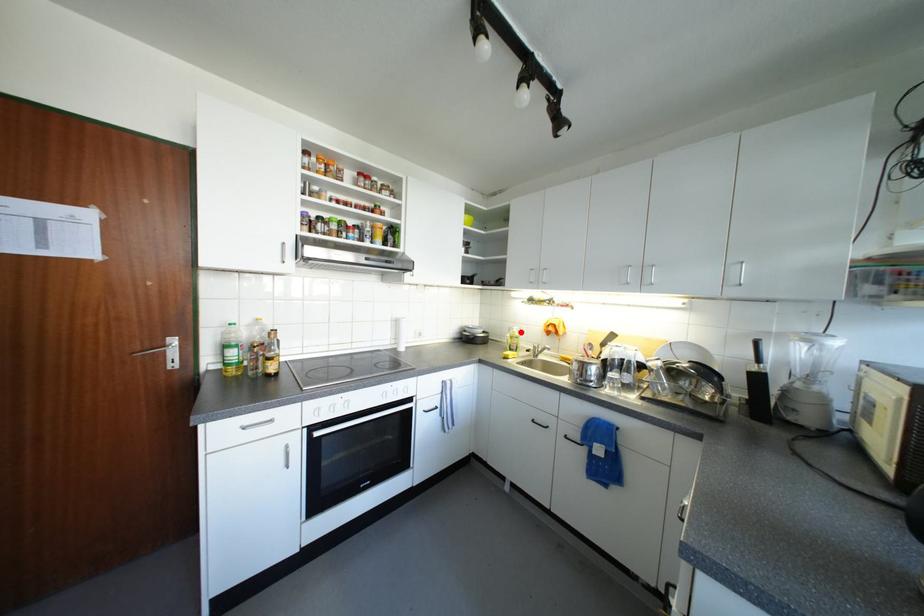
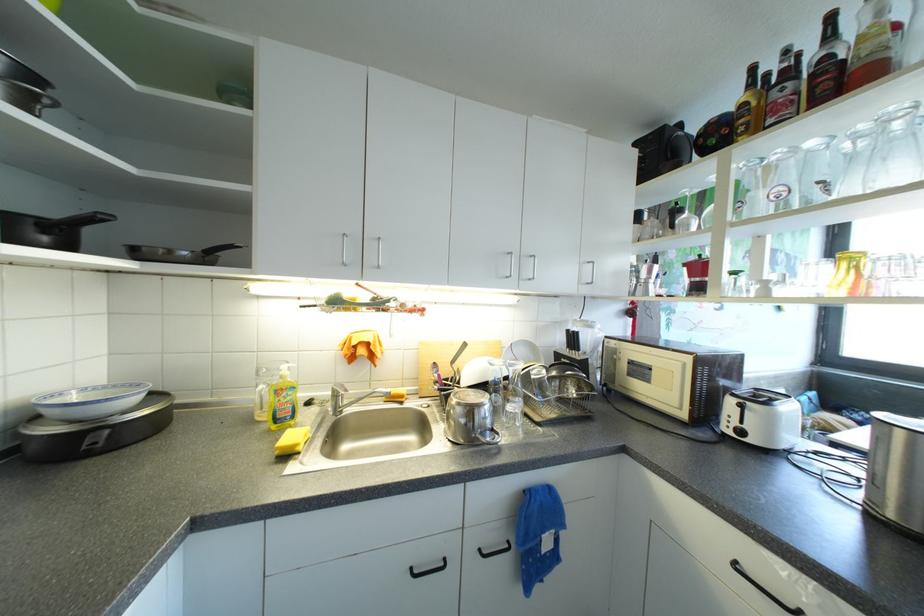
Question: I am providing you with two images of the same scene from different viewpoints. A red point is marked on the first image. Is the red point's position out of view in image 2?

Choices:
 (A) Yes
 (B) No

Answer: (B)